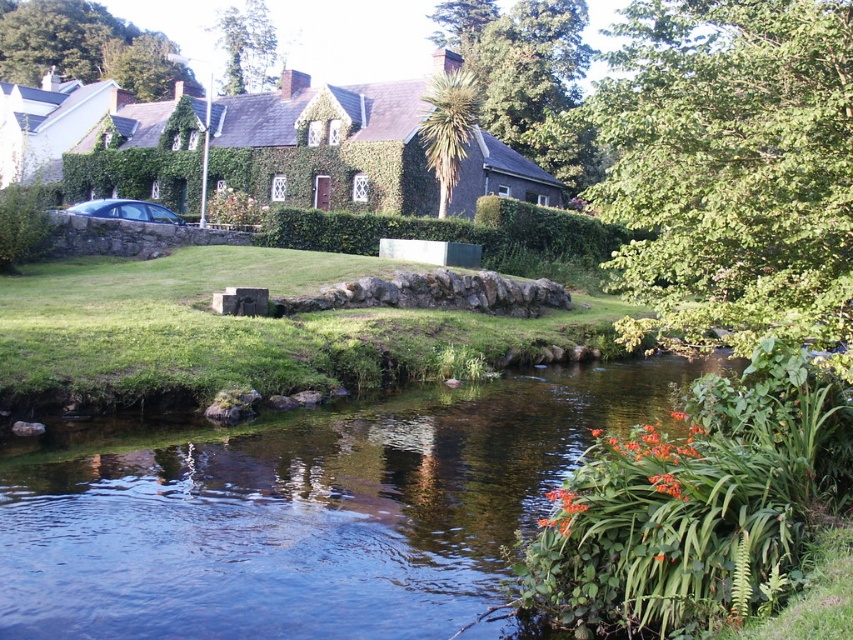
Is clear water at lower center bigger than satin black car at left?

Incorrect, clear water at lower center is not larger than satin black car at left.

Is clear water at lower center positioned before satin black car at left?

A: Yes.

Between point (480, 589) and point (103, 212), which one is positioned in front?

Point (480, 589) is in front.

Find the location of a particular element. clear water at lower center is located at coordinates (309, 515).

Who is shorter, green leafy hedge at center or satin black car at left?

satin black car at left

Locate an element on the screen. green leafy hedge at center is located at coordinates (466, 236).

Between point (517, 269) and point (120, 216), which one is positioned behind?

The point (517, 269) is more distant.

The width and height of the screenshot is (853, 640). Find the location of `green leafy hedge at center`. green leafy hedge at center is located at coordinates (466, 236).

Can you confirm if clear water at lower center is bigger than green leafy hedge at center?

No.

Which is in front, point (453, 426) or point (289, 227)?

Point (453, 426) is more forward.

I want to click on clear water at lower center, so tap(309, 515).